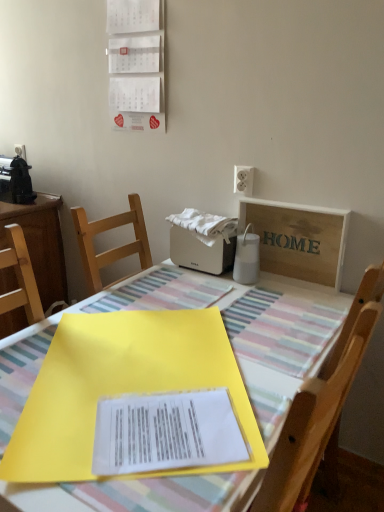
What are the coordinates of `empty space that is ontop of yellow paper at center (from a real-world perspective)` in the screenshot? It's located at (155, 419).